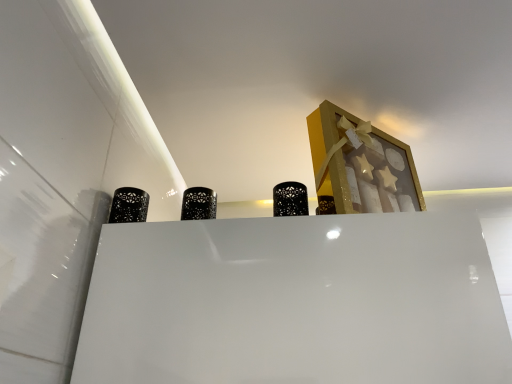
The image size is (512, 384). What are the coordinates of `gold paper picture frame at upper right` in the screenshot? It's located at (360, 165).

What do you see at coordinates (360, 165) in the screenshot? I see `gold paper picture frame at upper right` at bounding box center [360, 165].

The image size is (512, 384). Find the location of `gold paper picture frame at upper right`. gold paper picture frame at upper right is located at coordinates (360, 165).